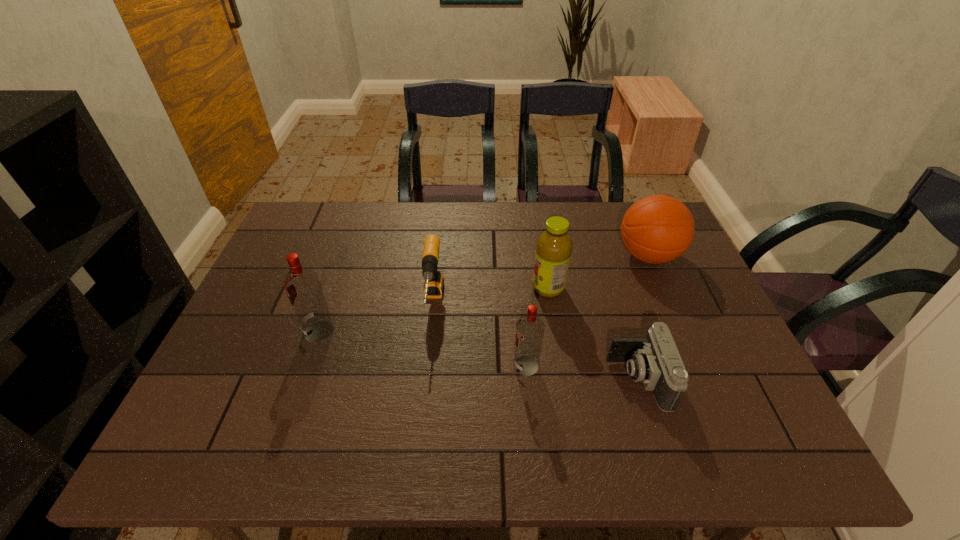
Please show where to add a vodka on the right while keeping spacing even. Please provide its 2D coordinates. Your answer should be formatted as a tuple, i.e. [(x, y)], where the tuple contains the x and y coordinates of a point satisfying the conditions above.

[(766, 406)]